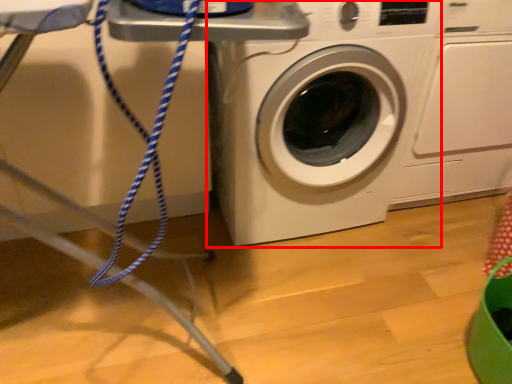
Question: From the image's perspective, what is the correct spatial relationship of washing machine (annotated by the red box) in relation to washing machine?

Choices:
 (A) above
 (B) below

Answer: (B)